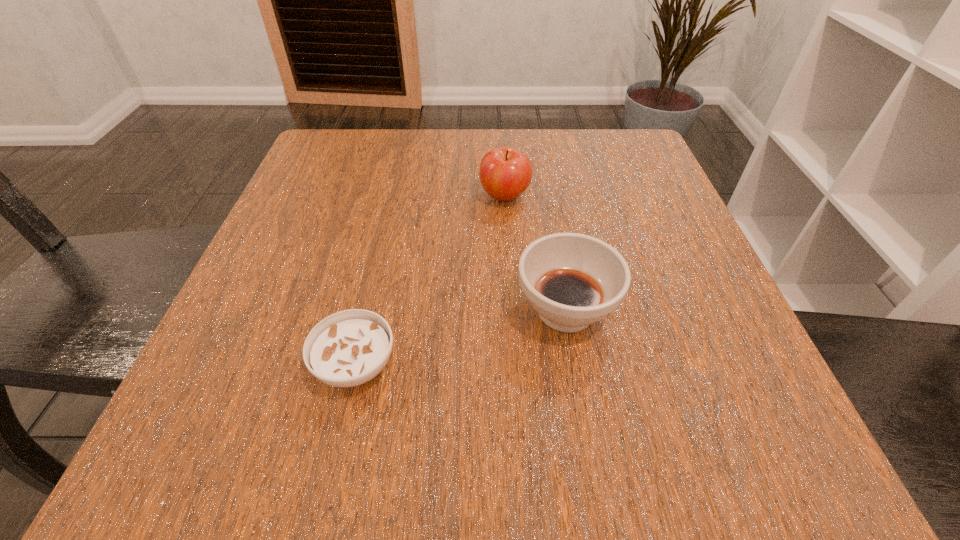
The image size is (960, 540). Find the location of `vacant space that is in between the right soup bowl and the left soup bowl`. vacant space that is in between the right soup bowl and the left soup bowl is located at coordinates (461, 338).

Image resolution: width=960 pixels, height=540 pixels. Identify the location of vacant area that lies between the shorter soup bowl and the right soup bowl. (461, 338).

Identify the location of vacant space in between the farthest object and the leftmost object. (430, 281).

I want to click on object identified as the closest to the shorter soup bowl, so click(x=572, y=280).

The width and height of the screenshot is (960, 540). I want to click on object that is the closest one to the left soup bowl, so click(x=572, y=280).

The height and width of the screenshot is (540, 960). Find the location of `blank area in the image that satisfies the following two spatial constraints: 1. on the back side of the apple; 2. on the left side of the shorter soup bowl`. blank area in the image that satisfies the following two spatial constraints: 1. on the back side of the apple; 2. on the left side of the shorter soup bowl is located at coordinates (395, 197).

Locate an element on the screen. free spot that satisfies the following two spatial constraints: 1. on the back side of the taller soup bowl; 2. on the right side of the shorter soup bowl is located at coordinates (369, 310).

The width and height of the screenshot is (960, 540). Identify the location of free spot that satisfies the following two spatial constraints: 1. on the back side of the apple; 2. on the right side of the shorter soup bowl. (395, 197).